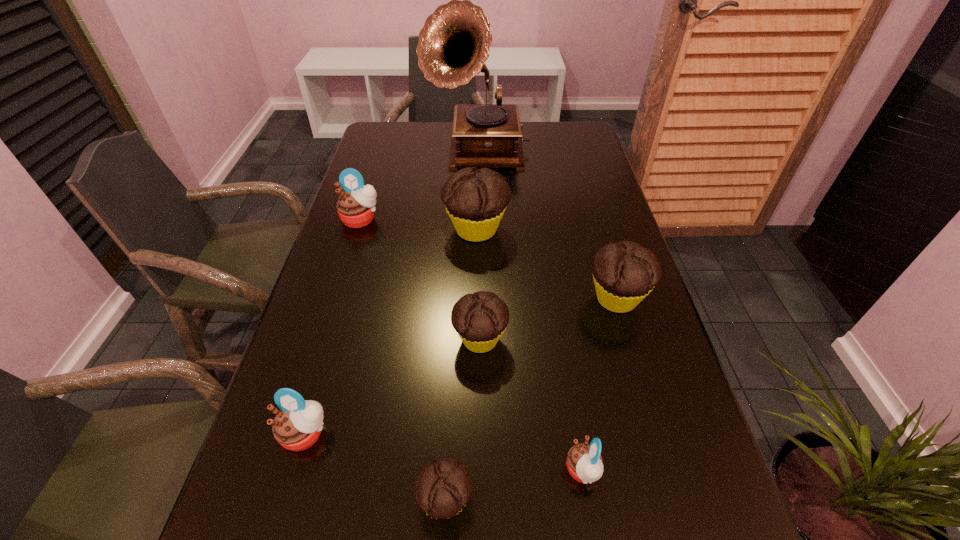
The height and width of the screenshot is (540, 960). What are the coordinates of `the nearest chocolate muffin` in the screenshot? It's located at (442, 488).

The image size is (960, 540). I want to click on free region located on the horn of the brown record player, so click(478, 218).

The height and width of the screenshot is (540, 960). Find the location of `free space located on the back of the farthest chocolate muffin`. free space located on the back of the farthest chocolate muffin is located at coordinates (477, 160).

Where is `blank space located on the front-facing side of the farthest pink muffin`? This screenshot has width=960, height=540. blank space located on the front-facing side of the farthest pink muffin is located at coordinates (330, 318).

Where is `vacant space located on the back of the rightmost object`? vacant space located on the back of the rightmost object is located at coordinates (595, 227).

At what (x,y) coordinates should I click in order to perform the action: click on free space located on the front-facing side of the second biggest pink muffin. Please return your answer as a coordinate pair (x, y). Image resolution: width=960 pixels, height=540 pixels. Looking at the image, I should click on (291, 485).

Locate an element on the screen. The width and height of the screenshot is (960, 540). vacant area situated on the right of the second smallest chocolate muffin is located at coordinates (629, 339).

Identify the location of free point located 0.090m on the front-facing side of the rightmost pink muffin. (512, 471).

The width and height of the screenshot is (960, 540). Identify the location of vacant position located 0.110m on the front-facing side of the rightmost pink muffin. (500, 471).

Find the location of `vacant space located on the front-facing side of the rightmost pink muffin`. vacant space located on the front-facing side of the rightmost pink muffin is located at coordinates (506, 471).